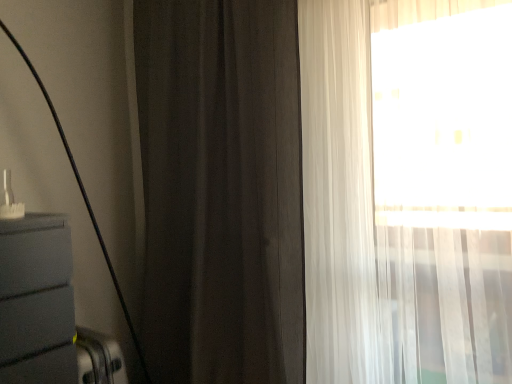
What do you see at coordinates (407, 190) in the screenshot?
I see `sheer white curtain at right, the second curtain when ordered from left to right` at bounding box center [407, 190].

The height and width of the screenshot is (384, 512). I want to click on sheer white curtain at right, which is counted as the 1th curtain, starting from the right, so click(x=407, y=190).

What are the coordinates of `dark matte curtain at center, acting as the first curtain starting from the left` in the screenshot? It's located at (221, 190).

Describe the element at coordinates (221, 190) in the screenshot. I see `dark matte curtain at center, which is the second curtain in right-to-left order` at that location.

I want to click on sheer white curtain at right, which is counted as the 1th curtain, starting from the right, so click(x=407, y=190).

Visually, is dark matte curtain at center, which is the second curtain in right-to-left order, positioned to the left or to the right of sheer white curtain at right, the second curtain when ordered from left to right?

Based on their positions, dark matte curtain at center, which is the second curtain in right-to-left order, is located to the left of sheer white curtain at right, the second curtain when ordered from left to right.

Does dark matte curtain at center, acting as the first curtain starting from the left, lie behind sheer white curtain at right, the second curtain when ordered from left to right?

Yes, dark matte curtain at center, acting as the first curtain starting from the left, is further from the viewer.

Considering the points (220, 240) and (317, 318), which point is in front, point (220, 240) or point (317, 318)?

Point (317, 318)

From the image's perspective, is dark matte curtain at center, acting as the first curtain starting from the left, below sheer white curtain at right, the second curtain when ordered from left to right?

Actually, dark matte curtain at center, acting as the first curtain starting from the left, appears above sheer white curtain at right, the second curtain when ordered from left to right, in the image.

From a real-world perspective, which object stands above the other?

dark matte curtain at center, which is the second curtain in right-to-left order, is physically above.

Is dark matte curtain at center, acting as the first curtain starting from the left, wider or thinner than sheer white curtain at right, the second curtain when ordered from left to right?

Considering their sizes, dark matte curtain at center, acting as the first curtain starting from the left, looks slimmer than sheer white curtain at right, the second curtain when ordered from left to right.

Between dark matte curtain at center, acting as the first curtain starting from the left, and sheer white curtain at right, which is counted as the 1th curtain, starting from the right, which one has less height?

With less height is sheer white curtain at right, which is counted as the 1th curtain, starting from the right.

Does dark matte curtain at center, acting as the first curtain starting from the left, have a larger size compared to sheer white curtain at right, which is counted as the 1th curtain, starting from the right?

Yes.

Would you say dark matte curtain at center, acting as the first curtain starting from the left, contains sheer white curtain at right, which is counted as the 1th curtain, starting from the right?

No.

Would you say dark matte curtain at center, which is the second curtain in right-to-left order, is a long distance from sheer white curtain at right, the second curtain when ordered from left to right?

That's not correct — dark matte curtain at center, which is the second curtain in right-to-left order, is a little close to sheer white curtain at right, the second curtain when ordered from left to right.

Looking at this image, is dark matte curtain at center, acting as the first curtain starting from the left, looking in the opposite direction of sheer white curtain at right, which is counted as the 1th curtain, starting from the right?

That's not correct — dark matte curtain at center, acting as the first curtain starting from the left, is not looking away from sheer white curtain at right, which is counted as the 1th curtain, starting from the right.

In the image, there is a dark matte curtain at center, which is the second curtain in right-to-left order. Identify the location of curtain below it (from a real-world perspective). (407, 190).

Considering the positions of objects sheer white curtain at right, the second curtain when ordered from left to right, and dark matte curtain at center, which is the second curtain in right-to-left order, in the image provided, who is more to the right, sheer white curtain at right, the second curtain when ordered from left to right, or dark matte curtain at center, which is the second curtain in right-to-left order,?

From the viewer's perspective, sheer white curtain at right, the second curtain when ordered from left to right, appears more on the right side.

Does sheer white curtain at right, which is counted as the 1th curtain, starting from the right, come in front of dark matte curtain at center, which is the second curtain in right-to-left order?

Yes, sheer white curtain at right, which is counted as the 1th curtain, starting from the right, is in front of dark matte curtain at center, which is the second curtain in right-to-left order.

Which is farther from the camera, [322,308] or [178,9]?

Positioned behind is point [178,9].

From the image's perspective, which is below, sheer white curtain at right, which is counted as the 1th curtain, starting from the right, or dark matte curtain at center, acting as the first curtain starting from the left?

sheer white curtain at right, which is counted as the 1th curtain, starting from the right.

From a real-world perspective, is sheer white curtain at right, the second curtain when ordered from left to right, over dark matte curtain at center, which is the second curtain in right-to-left order?

No.

Is sheer white curtain at right, the second curtain when ordered from left to right, wider than dark matte curtain at center, which is the second curtain in right-to-left order?

Correct, the width of sheer white curtain at right, the second curtain when ordered from left to right, exceeds that of dark matte curtain at center, which is the second curtain in right-to-left order.

Between sheer white curtain at right, which is counted as the 1th curtain, starting from the right, and dark matte curtain at center, which is the second curtain in right-to-left order, which one has less height?

Standing shorter between the two is sheer white curtain at right, which is counted as the 1th curtain, starting from the right.

In terms of size, does sheer white curtain at right, which is counted as the 1th curtain, starting from the right, appear bigger or smaller than dark matte curtain at center, which is the second curtain in right-to-left order?

Considering their sizes, sheer white curtain at right, which is counted as the 1th curtain, starting from the right, takes up less space than dark matte curtain at center, which is the second curtain in right-to-left order.

Is dark matte curtain at center, acting as the first curtain starting from the left, inside sheer white curtain at right, the second curtain when ordered from left to right?

No.

Is sheer white curtain at right, which is counted as the 1th curtain, starting from the right, next to dark matte curtain at center, which is the second curtain in right-to-left order?

sheer white curtain at right, which is counted as the 1th curtain, starting from the right, is not next to dark matte curtain at center, which is the second curtain in right-to-left order, and they're not touching.

Is sheer white curtain at right, which is counted as the 1th curtain, starting from the right, oriented towards dark matte curtain at center, acting as the first curtain starting from the left?

No, sheer white curtain at right, which is counted as the 1th curtain, starting from the right, is not turned towards dark matte curtain at center, acting as the first curtain starting from the left.

How different are the orientations of sheer white curtain at right, which is counted as the 1th curtain, starting from the right, and dark matte curtain at center, which is the second curtain in right-to-left order, in degrees?

2.26e-05 degrees separate the facing orientations of sheer white curtain at right, which is counted as the 1th curtain, starting from the right, and dark matte curtain at center, which is the second curtain in right-to-left order.

Where is `curtain above the sheer white curtain at right, which is counted as the 1th curtain, starting from the right (from the image's perspective)`? The image size is (512, 384). curtain above the sheer white curtain at right, which is counted as the 1th curtain, starting from the right (from the image's perspective) is located at coordinates 221,190.

This screenshot has height=384, width=512. I want to click on curtain lying on the right of dark matte curtain at center, which is the second curtain in right-to-left order, so click(407, 190).

In the image, there is a dark matte curtain at center, which is the second curtain in right-to-left order. Where is `curtain below it (from a real-world perspective)`? curtain below it (from a real-world perspective) is located at coordinates (407, 190).